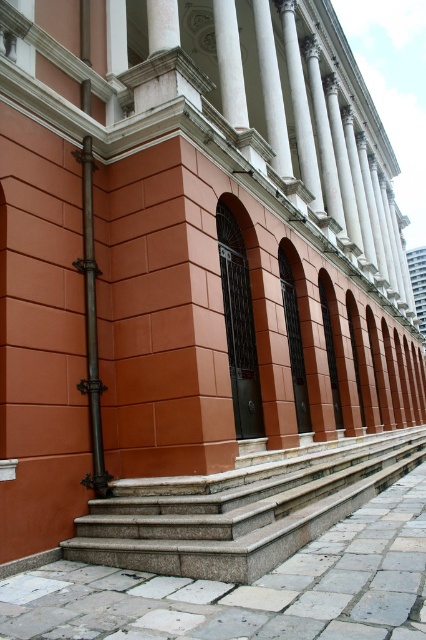
Can you confirm if granite steps at lower center is bigger than white marble pillar at upper center?

Yes, granite steps at lower center is bigger than white marble pillar at upper center.

Is granite steps at lower center shorter than white marble pillar at upper center?

Yes, granite steps at lower center is shorter than white marble pillar at upper center.

Which is behind, point (103, 508) or point (236, 86)?

The point (236, 86) is more distant.

Image resolution: width=426 pixels, height=640 pixels. I want to click on granite steps at lower center, so click(241, 508).